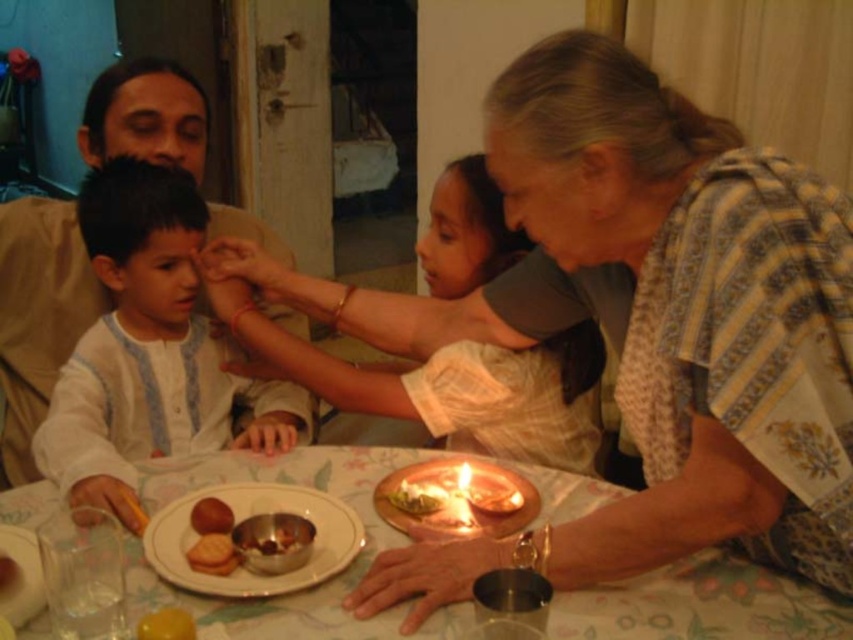
Question: Among these points, which one is nearest to the camera?

Choices:
 (A) (427, 513)
 (B) (751, 449)

Answer: (B)

Question: Can you confirm if light blue cotton shirt at center is wider than smooth brown bread at center?

Choices:
 (A) no
 (B) yes

Answer: (B)

Question: Which point is farther from the camera taking this photo?

Choices:
 (A) (404, 480)
 (B) (405, 476)
 (C) (219, 524)
 (D) (207, 586)

Answer: (B)

Question: Which of the following is the closest to the observer?

Choices:
 (A) light blue cotton shirt at center
 (B) white ceramic plate at center
 (C) matte copper candle at center
 (D) floral-patterned sari at center

Answer: (D)

Question: Is light blue cotton shirt at center closer to the viewer compared to matte silver platter at lower left?

Choices:
 (A) no
 (B) yes

Answer: (A)

Question: Is shiny metallic bowl at center wider than matte copper candle at center?

Choices:
 (A) no
 (B) yes

Answer: (B)